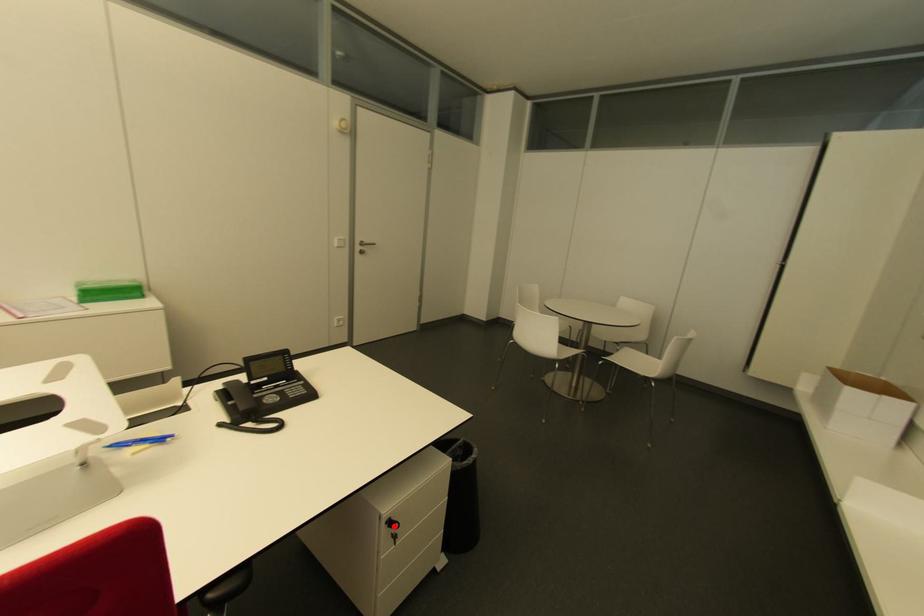
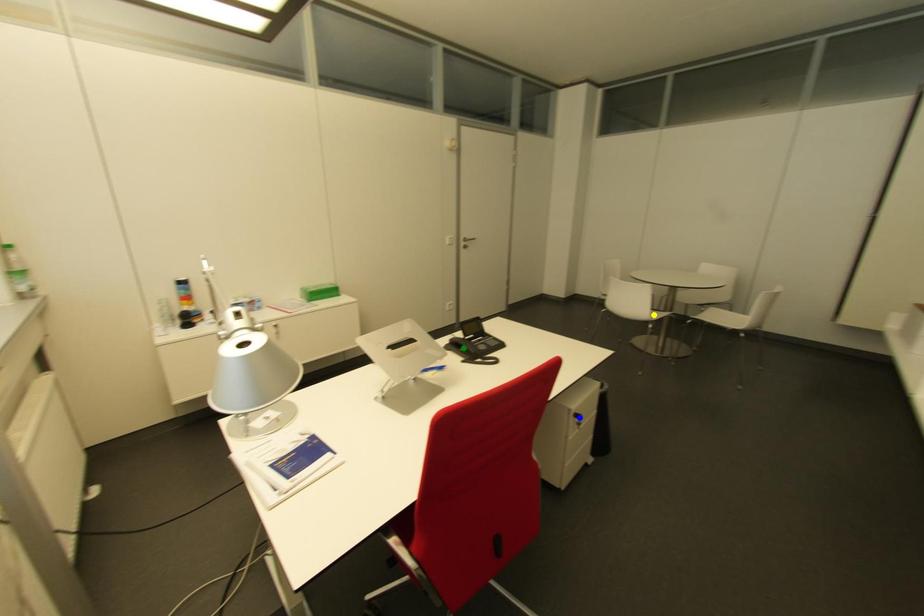
Question: I am providing you with two images of the same scene from different viewpoints. A red point is marked on the first image. You are given multiple points on the second image. Can you choose the point in image 2 that corresponds to the point in image 1?

Choices:
 (A) green point
 (B) blue point
 (C) yellow point

Answer: (B)